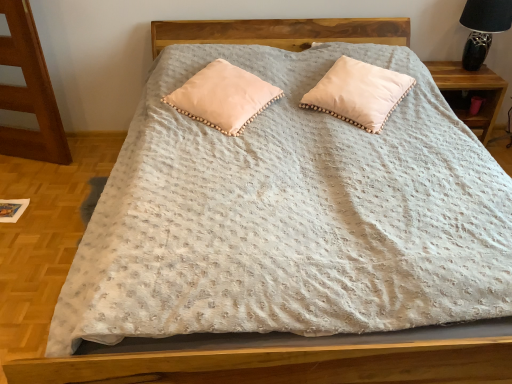
Image resolution: width=512 pixels, height=384 pixels. What do you see at coordinates (470, 92) in the screenshot?
I see `wooden nightstand at right` at bounding box center [470, 92].

The image size is (512, 384). Describe the element at coordinates (358, 93) in the screenshot. I see `peachy soft pillow at upper center, the 2th pillow in the left-to-right sequence` at that location.

This screenshot has width=512, height=384. Identify the location of wooden nightstand at right. (470, 92).

From the image's perspective, is peachy soft pillow at upper center, the 2th pillow in the left-to-right sequence, under black ceramic table lamp at upper right?

Yes, from the image's perspective, peachy soft pillow at upper center, the 2th pillow in the left-to-right sequence, is below black ceramic table lamp at upper right.

Image resolution: width=512 pixels, height=384 pixels. In order to click on table lamp positioned vertically above the peachy soft pillow at upper center, the 2th pillow in the left-to-right sequence (from a real-world perspective) in this screenshot , I will do `click(483, 28)`.

Does peachy soft pillow at upper center, the 2th pillow in the left-to-right sequence, lie in front of black ceramic table lamp at upper right?

Yes, peachy soft pillow at upper center, the 2th pillow in the left-to-right sequence, is closer to the camera.

Does point (374, 132) appear closer or farther from the camera than point (481, 33)?

Clearly, point (374, 132) is closer to the camera than point (481, 33).

Looking at the image, does black ceramic table lamp at upper right seem bigger or smaller compared to wooden nightstand at right?

Considering their sizes, black ceramic table lamp at upper right takes up less space than wooden nightstand at right.

What are the coordinates of `table lamp on the right of wooden nightstand at right` in the screenshot? It's located at (483, 28).

Is the surface of black ceramic table lamp at upper right in direct contact with wooden nightstand at right?

No, black ceramic table lamp at upper right is not next to wooden nightstand at right.

Is black ceramic table lamp at upper right facing away from wooden nightstand at right?

black ceramic table lamp at upper right does not have its back to wooden nightstand at right.

Can you confirm if peachy soft pillow at upper center, arranged as the first pillow when viewed from the right, is bigger than wooden nightstand at right?

Incorrect, peachy soft pillow at upper center, arranged as the first pillow when viewed from the right, is not larger than wooden nightstand at right.

Is peachy soft pillow at upper center, the 2th pillow in the left-to-right sequence, aimed at wooden nightstand at right?

No, peachy soft pillow at upper center, the 2th pillow in the left-to-right sequence, is not facing towards wooden nightstand at right.

From a real-world perspective, is peachy soft pillow at upper center, the 2th pillow in the left-to-right sequence, below wooden nightstand at right?

No, from a real-world perspective, peachy soft pillow at upper center, the 2th pillow in the left-to-right sequence, is not under wooden nightstand at right.

From a real-world perspective, count 2nd pillows upward from the wooden nightstand at right and point to it. Please provide its 2D coordinates.

[(358, 93)]

Is peachy soft pillow at center, arranged as the 2th pillow when viewed from the right, surrounding black ceramic table lamp at upper right?

No, peachy soft pillow at center, arranged as the 2th pillow when viewed from the right, does not contain black ceramic table lamp at upper right.

Is peachy soft pillow at center, the first pillow positioned from the left, facing towards black ceramic table lamp at upper right?

No, peachy soft pillow at center, the first pillow positioned from the left, is not oriented towards black ceramic table lamp at upper right.

Is peachy soft pillow at center, arranged as the 2th pillow when viewed from the right, closer to camera compared to black ceramic table lamp at upper right?

Yes, peachy soft pillow at center, arranged as the 2th pillow when viewed from the right, is in front of black ceramic table lamp at upper right.

From a real-world perspective, which is physically above, peachy soft pillow at center, arranged as the 2th pillow when viewed from the right, or black ceramic table lamp at upper right?

black ceramic table lamp at upper right.

Is point (193, 100) more distant than point (330, 107)?

No.

Which of these two, peachy soft pillow at center, arranged as the 2th pillow when viewed from the right, or peachy soft pillow at upper center, the 2th pillow in the left-to-right sequence, stands taller?

With more height is peachy soft pillow at upper center, the 2th pillow in the left-to-right sequence.

At what (x,y) coordinates should I click in order to perform the action: click on pillow in front of the peachy soft pillow at upper center, arranged as the first pillow when viewed from the right. Please return your answer as a coordinate pair (x, y). The height and width of the screenshot is (384, 512). Looking at the image, I should click on (223, 97).

Considering the relative sizes of peachy soft pillow at upper center, the 2th pillow in the left-to-right sequence, and peachy soft pillow at center, arranged as the 2th pillow when viewed from the right, in the image provided, is peachy soft pillow at upper center, the 2th pillow in the left-to-right sequence, smaller than peachy soft pillow at center, arranged as the 2th pillow when viewed from the right,?

No, peachy soft pillow at upper center, the 2th pillow in the left-to-right sequence, is not smaller than peachy soft pillow at center, arranged as the 2th pillow when viewed from the right.

Is peachy soft pillow at upper center, arranged as the first pillow when viewed from the right, further to the viewer compared to peachy soft pillow at center, the first pillow positioned from the left?

Yes, peachy soft pillow at upper center, arranged as the first pillow when viewed from the right, is behind peachy soft pillow at center, the first pillow positioned from the left.

From a real-world perspective, between peachy soft pillow at upper center, arranged as the first pillow when viewed from the right, and peachy soft pillow at center, the first pillow positioned from the left, who is vertically lower?

peachy soft pillow at center, the first pillow positioned from the left, from a real-world perspective.

This screenshot has width=512, height=384. What are the coordinates of `pillow that appears in front of the peachy soft pillow at upper center, arranged as the first pillow when viewed from the right` in the screenshot? It's located at (223, 97).

Which object is positioned more to the left, black ceramic table lamp at upper right or peachy soft pillow at upper center, the 2th pillow in the left-to-right sequence?

Positioned to the left is peachy soft pillow at upper center, the 2th pillow in the left-to-right sequence.

Can you tell me how much black ceramic table lamp at upper right and peachy soft pillow at upper center, arranged as the first pillow when viewed from the right, differ in facing direction?

There is a 37.9-degree angle between the facing directions of black ceramic table lamp at upper right and peachy soft pillow at upper center, arranged as the first pillow when viewed from the right.

Based on the photo, would you say black ceramic table lamp at upper right is a long distance from peachy soft pillow at upper center, arranged as the first pillow when viewed from the right?

No, black ceramic table lamp at upper right is not far away from peachy soft pillow at upper center, arranged as the first pillow when viewed from the right.

Considering their positions, is black ceramic table lamp at upper right located in front of or behind peachy soft pillow at upper center, the 2th pillow in the left-to-right sequence?

Clearly, black ceramic table lamp at upper right is behind peachy soft pillow at upper center, the 2th pillow in the left-to-right sequence.

Identify the location of pillow that is the 1st object located in front of the black ceramic table lamp at upper right. This screenshot has width=512, height=384. (358, 93).

Where is `nightstand below the black ceramic table lamp at upper right (from the image's perspective)`? The width and height of the screenshot is (512, 384). nightstand below the black ceramic table lamp at upper right (from the image's perspective) is located at coordinates (470, 92).

From the image, which object appears to be farther from peachy soft pillow at center, arranged as the 2th pillow when viewed from the right, black ceramic table lamp at upper right or peachy soft pillow at upper center, arranged as the first pillow when viewed from the right?

Among the two, black ceramic table lamp at upper right is located further to peachy soft pillow at center, arranged as the 2th pillow when viewed from the right.

Considering their positions, is peachy soft pillow at upper center, arranged as the first pillow when viewed from the right, positioned closer to wooden nightstand at right than black ceramic table lamp at upper right?

black ceramic table lamp at upper right is closer to wooden nightstand at right.

Looking at the image, which one is located closer to peachy soft pillow at center, arranged as the 2th pillow when viewed from the right, peachy soft pillow at upper center, the 2th pillow in the left-to-right sequence, or black ceramic table lamp at upper right?

Based on the image, peachy soft pillow at upper center, the 2th pillow in the left-to-right sequence, appears to be nearer to peachy soft pillow at center, arranged as the 2th pillow when viewed from the right.

Looking at this image, based on their spatial positions, is wooden nightstand at right or peachy soft pillow at center, the first pillow positioned from the left, further from peachy soft pillow at upper center, arranged as the first pillow when viewed from the right?

Among the two, wooden nightstand at right is located further to peachy soft pillow at upper center, arranged as the first pillow when viewed from the right.

Which object lies nearer to the anchor point peachy soft pillow at upper center, the 2th pillow in the left-to-right sequence, wooden nightstand at right or black ceramic table lamp at upper right?

wooden nightstand at right is closer to peachy soft pillow at upper center, the 2th pillow in the left-to-right sequence.

Based on their spatial positions, is peachy soft pillow at upper center, arranged as the first pillow when viewed from the right, or peachy soft pillow at center, arranged as the 2th pillow when viewed from the right, further from wooden nightstand at right?

The object further to wooden nightstand at right is peachy soft pillow at center, arranged as the 2th pillow when viewed from the right.

From the image, which object appears to be nearer to peachy soft pillow at center, the first pillow positioned from the left, peachy soft pillow at upper center, the 2th pillow in the left-to-right sequence, or wooden nightstand at right?

peachy soft pillow at upper center, the 2th pillow in the left-to-right sequence, is closer to peachy soft pillow at center, the first pillow positioned from the left.

Looking at this image, estimate the real-world distances between objects in this image. Which object is further from peachy soft pillow at upper center, the 2th pillow in the left-to-right sequence, peachy soft pillow at center, the first pillow positioned from the left, or wooden nightstand at right?

The object further to peachy soft pillow at upper center, the 2th pillow in the left-to-right sequence, is wooden nightstand at right.

Where is `nightstand between peachy soft pillow at upper center, the 2th pillow in the left-to-right sequence, and black ceramic table lamp at upper right, in the horizontal direction`? nightstand between peachy soft pillow at upper center, the 2th pillow in the left-to-right sequence, and black ceramic table lamp at upper right, in the horizontal direction is located at coordinates (470, 92).

At what (x,y) coordinates should I click in order to perform the action: click on pillow between peachy soft pillow at center, the first pillow positioned from the left, and black ceramic table lamp at upper right, in the horizontal direction. Please return your answer as a coordinate pair (x, y). Looking at the image, I should click on (358, 93).

I want to click on nightstand situated between peachy soft pillow at center, arranged as the 2th pillow when viewed from the right, and black ceramic table lamp at upper right from left to right, so click(x=470, y=92).

Find the location of a particular element. This screenshot has height=384, width=512. pillow between peachy soft pillow at center, the first pillow positioned from the left, and wooden nightstand at right, in the horizontal direction is located at coordinates (358, 93).